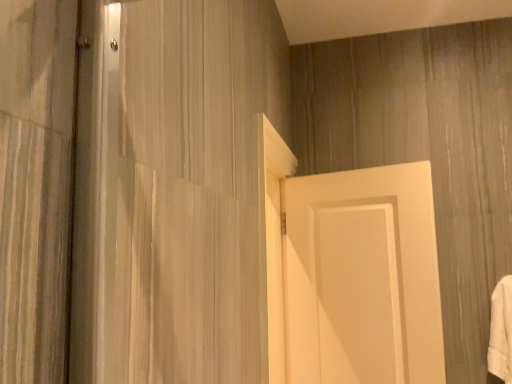
Question: Relative to white matte door at center, is white soft towel at right in front or behind?

Choices:
 (A) behind
 (B) front

Answer: (A)

Question: Is point (494, 294) positioned closer to the camera than point (425, 369)?

Choices:
 (A) farther
 (B) closer

Answer: (A)

Question: Considering the positions of white soft towel at right and white matte door at center in the image, is white soft towel at right taller or shorter than white matte door at center?

Choices:
 (A) tall
 (B) short

Answer: (B)

Question: Considering the positions of white matte door at center and white soft towel at right in the image, is white matte door at center wider or thinner than white soft towel at right?

Choices:
 (A) wide
 (B) thin

Answer: (B)

Question: Does point (375, 261) appear closer or farther from the camera than point (506, 278)?

Choices:
 (A) farther
 (B) closer

Answer: (A)

Question: From the image's perspective, is white matte door at center located above or below white soft towel at right?

Choices:
 (A) above
 (B) below

Answer: (A)

Question: Is white matte door at center to the left or to the right of white soft towel at right in the image?

Choices:
 (A) left
 (B) right

Answer: (A)